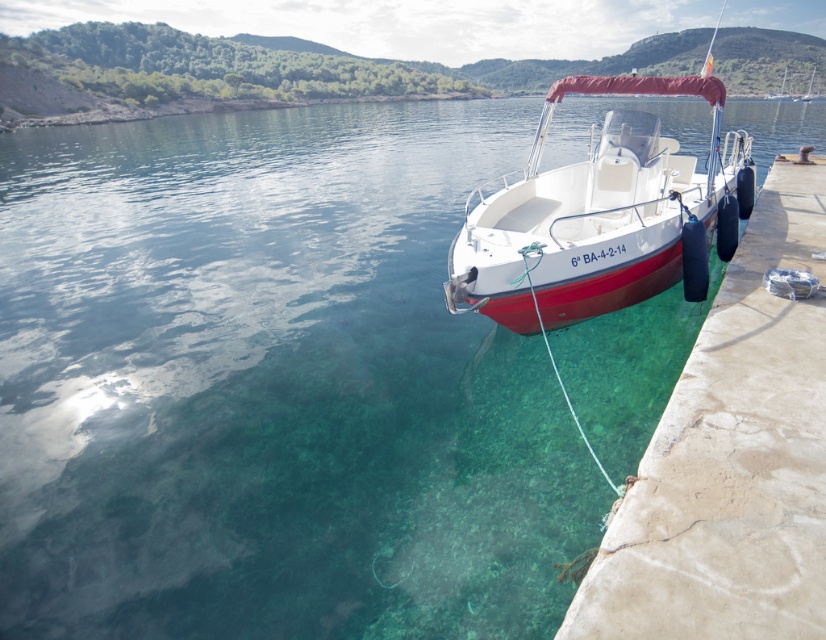
Is point (658, 438) positioned in front of point (656, 184)?

Yes, it is.

In the scene shown: Who is higher up, concrete at right or white glossy boat at right?

white glossy boat at right is above.

You are a GUI agent. You are given a task and a screenshot of the screen. Output one action in this format:
    pyautogui.click(x=<x>, y=<y>)
    Task: Click on the concrete at right
    
    Given the screenshot: What is the action you would take?
    pyautogui.click(x=730, y=458)

Identify the location of concrete at right. (730, 458).